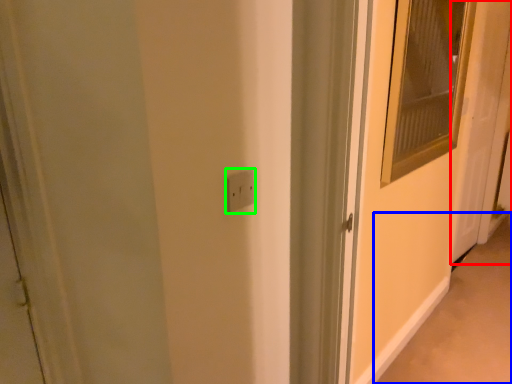
Question: Which object is the farthest from door (highlighted by a red box)? Choose among these: alley (highlighted by a blue box) or electric outlet (highlighted by a green box).

Choices:
 (A) alley
 (B) electric outlet

Answer: (B)